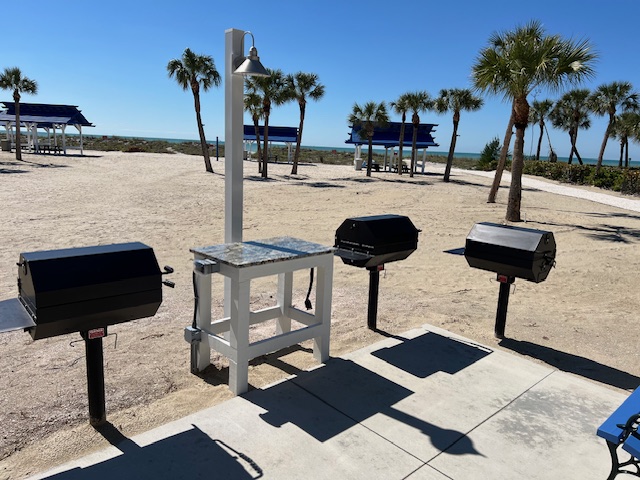
This screenshot has height=480, width=640. In order to click on blue bench in this screenshot , I will do `click(624, 414)`.